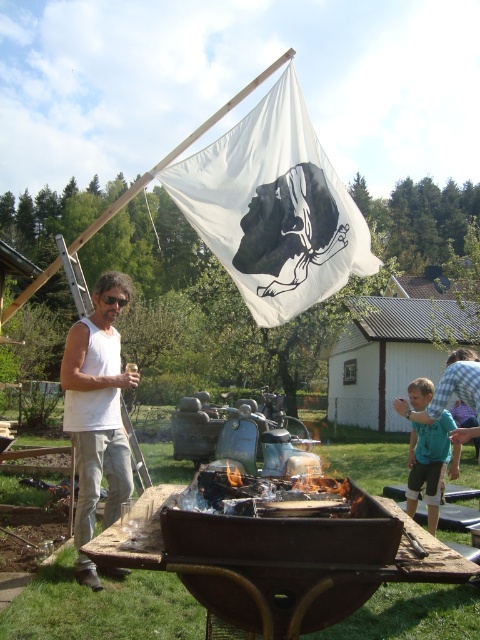
Question: Which of these objects is positioned farthest from the white fabric flag at upper center?

Choices:
 (A) white sleeveless shirt at left
 (B) charcoal grill at center

Answer: (B)

Question: Is white fabric flag at upper center positioned before white sleeveless shirt at left?

Choices:
 (A) no
 (B) yes

Answer: (A)

Question: Is white fabric flag at upper center positioned at the back of charcoal grill at center?

Choices:
 (A) yes
 (B) no

Answer: (A)

Question: Among these points, which one is farthest from the camera?

Choices:
 (A) (117, 465)
 (B) (444, 436)

Answer: (B)

Question: Which point is farther to the camera?

Choices:
 (A) teal fabric shirt at right
 (B) white fabric flag at upper center

Answer: (B)

Question: Can you confirm if white fabric flag at upper center is thinner than charcoal grill at center?

Choices:
 (A) no
 (B) yes

Answer: (A)